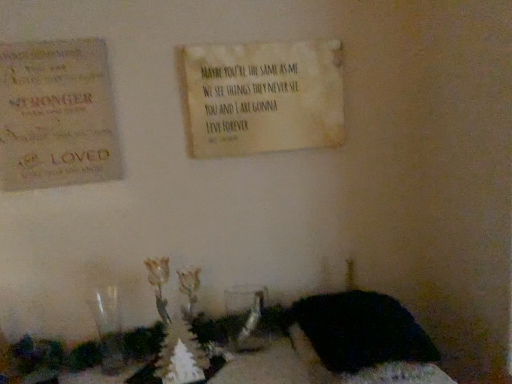
Question: Can you confirm if beige textured sign at upper center is smaller than rustic wood sign at upper left?

Choices:
 (A) no
 (B) yes

Answer: (A)

Question: Is rustic wood sign at upper left completely or partially inside beige textured sign at upper center?

Choices:
 (A) yes
 (B) no

Answer: (B)

Question: Is the depth of beige textured sign at upper center greater than that of rustic wood sign at upper left?

Choices:
 (A) yes
 (B) no

Answer: (A)

Question: Is beige textured sign at upper center thinner than rustic wood sign at upper left?

Choices:
 (A) yes
 (B) no

Answer: (A)

Question: Considering the relative positions of beige textured sign at upper center and rustic wood sign at upper left in the image provided, is beige textured sign at upper center to the left of rustic wood sign at upper left from the viewer's perspective?

Choices:
 (A) yes
 (B) no

Answer: (B)

Question: Considering the positions of black fabric at lower right and beige textured sign at upper center in the image, is black fabric at lower right wider or thinner than beige textured sign at upper center?

Choices:
 (A) wide
 (B) thin

Answer: (A)

Question: Is black fabric at lower right inside the boundaries of beige textured sign at upper center, or outside?

Choices:
 (A) outside
 (B) inside

Answer: (A)

Question: Considering the positions of point (314, 352) and point (328, 67), is point (314, 352) closer or farther from the camera than point (328, 67)?

Choices:
 (A) closer
 (B) farther

Answer: (A)

Question: Is black fabric at lower right taller or shorter than beige textured sign at upper center?

Choices:
 (A) short
 (B) tall

Answer: (A)

Question: Would you say beige textured sign at upper center is inside or outside rustic wood sign at upper left?

Choices:
 (A) outside
 (B) inside

Answer: (A)

Question: In terms of width, does beige textured sign at upper center look wider or thinner when compared to rustic wood sign at upper left?

Choices:
 (A) thin
 (B) wide

Answer: (A)

Question: Is beige textured sign at upper center taller or shorter than rustic wood sign at upper left?

Choices:
 (A) short
 (B) tall

Answer: (A)

Question: From the image's perspective, is beige textured sign at upper center positioned above or below rustic wood sign at upper left?

Choices:
 (A) above
 (B) below

Answer: (A)

Question: Considering the positions of rustic wood sign at upper left and beige textured sign at upper center in the image, is rustic wood sign at upper left bigger or smaller than beige textured sign at upper center?

Choices:
 (A) big
 (B) small

Answer: (B)

Question: Is point (89, 92) positioned closer to the camera than point (234, 64)?

Choices:
 (A) farther
 (B) closer

Answer: (B)